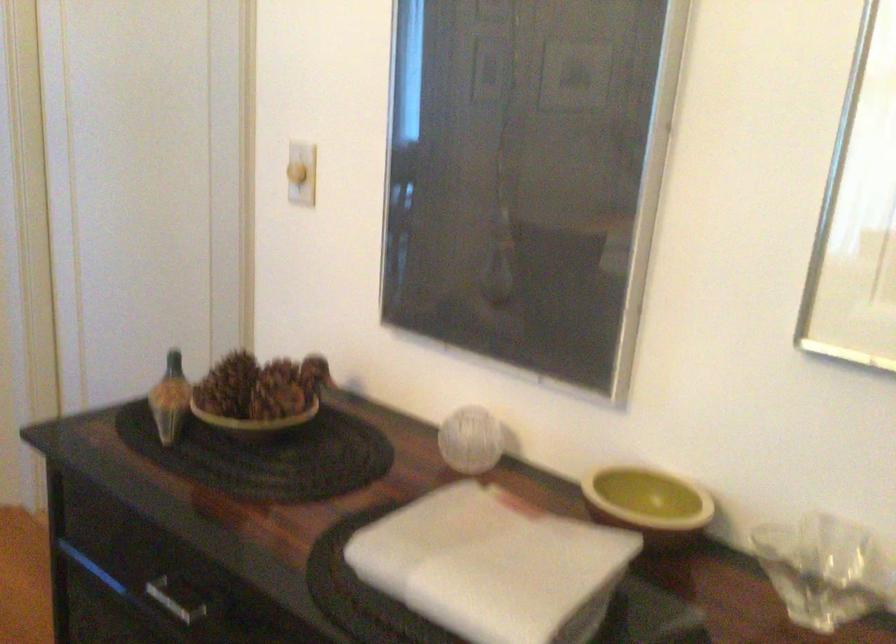
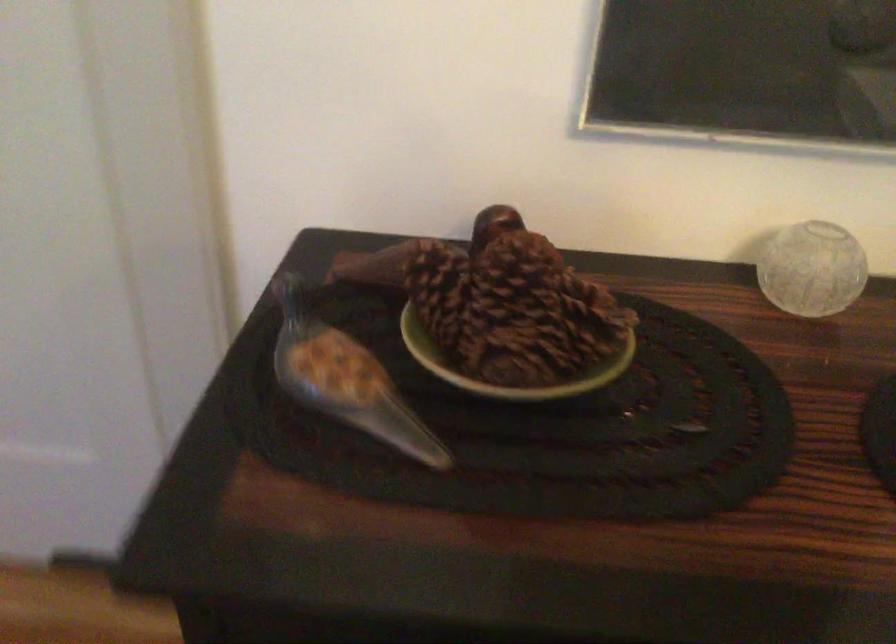
Locate, in the second image, the point that corresponds to (201,408) in the first image.

(506, 366)